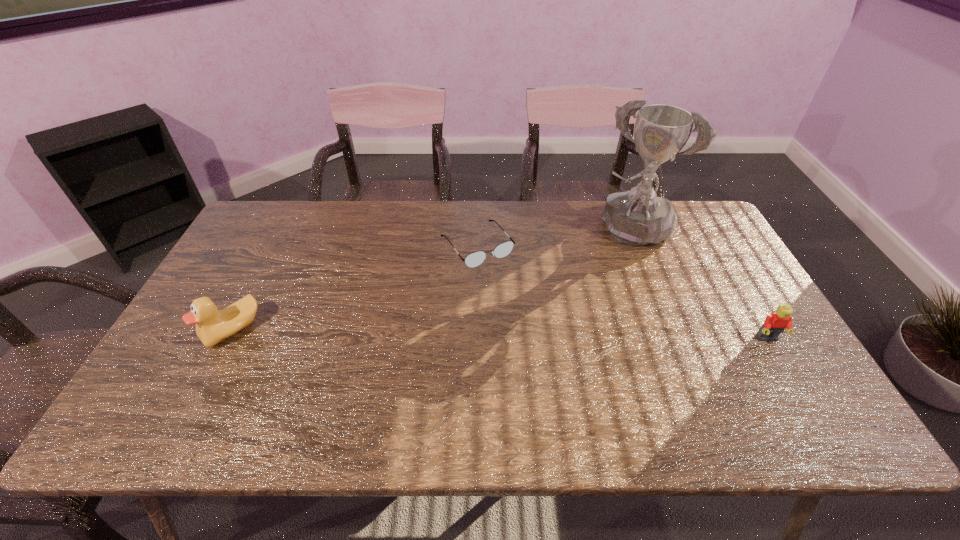
The width and height of the screenshot is (960, 540). In order to click on free space located 0.370m on the side with emblem of the award in this screenshot , I will do `click(563, 323)`.

Image resolution: width=960 pixels, height=540 pixels. Identify the location of free space located 0.210m on the side with emblem of the award. pos(587,287).

Where is `vacant space located 0.380m on the side with emblem of the award`? The width and height of the screenshot is (960, 540). vacant space located 0.380m on the side with emblem of the award is located at coordinates (561, 326).

The height and width of the screenshot is (540, 960). I want to click on spectacles at the far edge, so click(x=502, y=250).

The width and height of the screenshot is (960, 540). Find the location of `award that is at the far edge`. award that is at the far edge is located at coordinates (638, 217).

Locate an element on the screen. The height and width of the screenshot is (540, 960). object that is at the left edge is located at coordinates (212, 326).

The height and width of the screenshot is (540, 960). I want to click on Lego present at the right edge, so click(x=774, y=324).

Identify the location of award situated at the right edge. This screenshot has height=540, width=960. (638, 217).

Where is `object that is at the far right corner`? The image size is (960, 540). object that is at the far right corner is located at coordinates (638, 217).

This screenshot has height=540, width=960. Find the location of `vacant space at the far edge of the desktop`. vacant space at the far edge of the desktop is located at coordinates (579, 208).